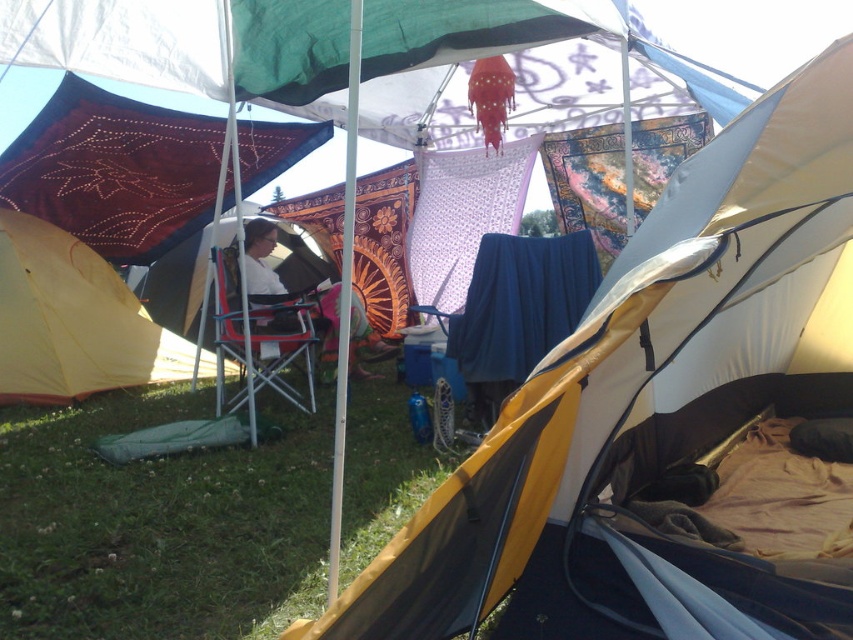
You are setting up a campsite and have both the yellow fabric tent at center and the white fabric chair at center. Which object should you place first if you want to maximize space efficiency?

The yellow fabric tent at center is larger in size than the white fabric chair at center, so you should place the yellow fabric tent at center first to ensure there is enough space for it before arranging smaller items like the white fabric chair at center.